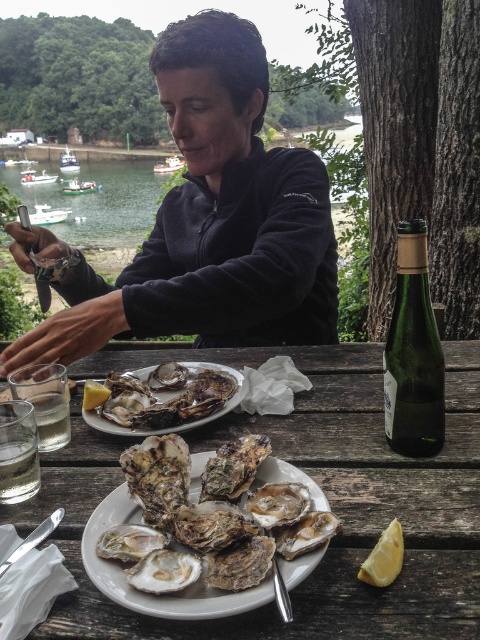
Is point (273, 305) closer to viewer compared to point (425, 294)?

That is False.

Does dark blue fleece at center come in front of green glass bottle at center-right?

No.

Is point (245, 296) more distant than point (394, 406)?

Yes.

Where is `dark blue fleece at center`? dark blue fleece at center is located at coordinates (205, 221).

Is the position of green glass bottle at center-right less distant than that of shiny silver oyster at center?

Yes, green glass bottle at center-right is in front of shiny silver oyster at center.

Consider the image. Can you confirm if green glass bottle at center-right is thinner than shiny silver oyster at center?

Indeed, green glass bottle at center-right has a lesser width compared to shiny silver oyster at center.

At what (x,y) coordinates should I click in order to perform the action: click on green glass bottle at center-right. Please return your answer as a coordinate pair (x, y). Looking at the image, I should click on (412, 353).

Between shiny silver oyster at center and clear glass water at lower left, which one has more height?

shiny silver oyster at center

Between shiny silver oyster at center and clear glass water at lower left, which one is positioned lower?

clear glass water at lower left

The height and width of the screenshot is (640, 480). Find the location of `shiny silver oyster at center`. shiny silver oyster at center is located at coordinates (168, 400).

Where is `shiny silver oyster at center`? This screenshot has width=480, height=640. shiny silver oyster at center is located at coordinates pos(168,400).